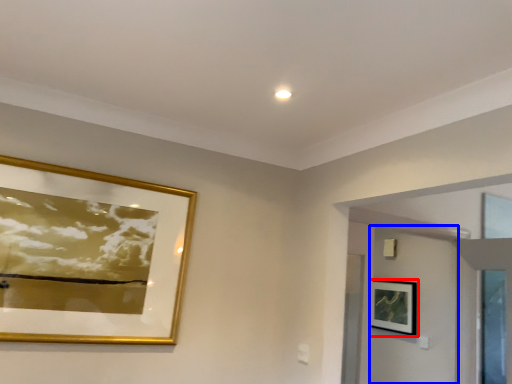
Question: Which point is closer to the camera, picture frame (highlighted by a red box) or door (highlighted by a blue box)?

Choices:
 (A) picture frame
 (B) door

Answer: (B)